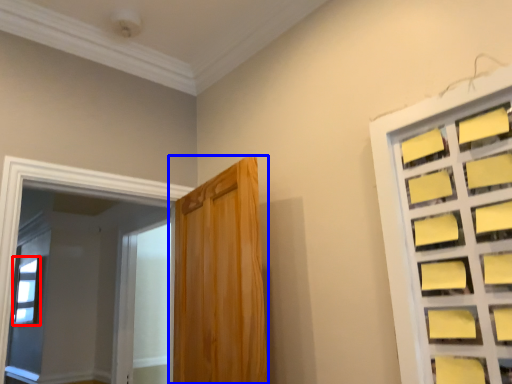
Question: Among these objects, which one is nearest to the camera, window (highlighted by a red box) or door (highlighted by a blue box)?

Choices:
 (A) window
 (B) door

Answer: (B)